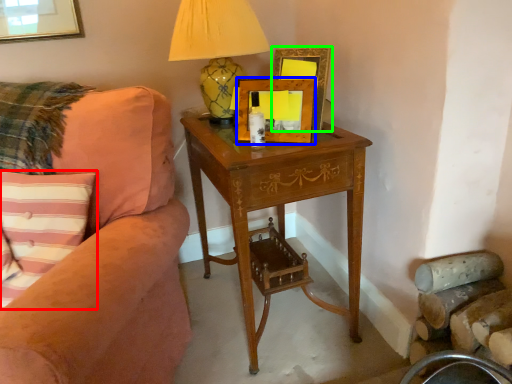
Question: Which is nearer to the pillow (highlighted by a red box)? picture frame (highlighted by a blue box) or picture frame (highlighted by a green box).

Choices:
 (A) picture frame
 (B) picture frame

Answer: (A)